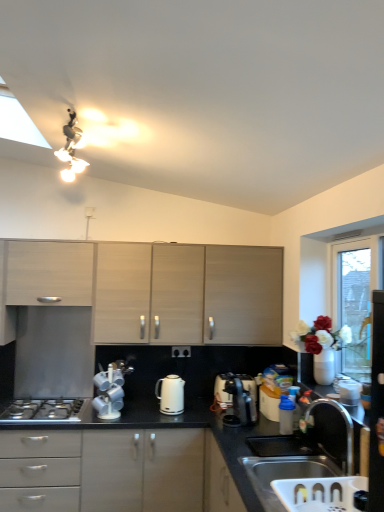
Question: Is silver metallic sink at lower right to the left or to the right of matte wood cabinets at center, the second cabinetry when ordered from left to right, in the image?

Choices:
 (A) right
 (B) left

Answer: (A)

Question: Does point (296, 455) appear closer or farther from the camera than point (210, 259)?

Choices:
 (A) farther
 (B) closer

Answer: (B)

Question: Considering the real-world distances, which object is farthest from the satin silver coffee machine at lower center, which is the first coffee machine in right-to-left order?

Choices:
 (A) silver metallic gas stove at lower left
 (B) satin nickel faucet at sink right
 (C) black matte countertop at center
 (D) white glossy electric kettle at center
 (E) matte wood cabinets at center, the second cabinetry when ordered from left to right

Answer: (A)

Question: Which object is the closest to the silver metallic gas stove at lower left?

Choices:
 (A) white glossy kettle at upper center, the 1th appliance viewed from the right
 (B) white glossy toaster at lower right, which appears as the 3th appliance when viewed from the front
 (C) silver metallic sink at lower right
 (D) transparent glass door at right
 (E) satin silver coffee machine at lower center, which is the 2th coffee machine from left to right

Answer: (E)